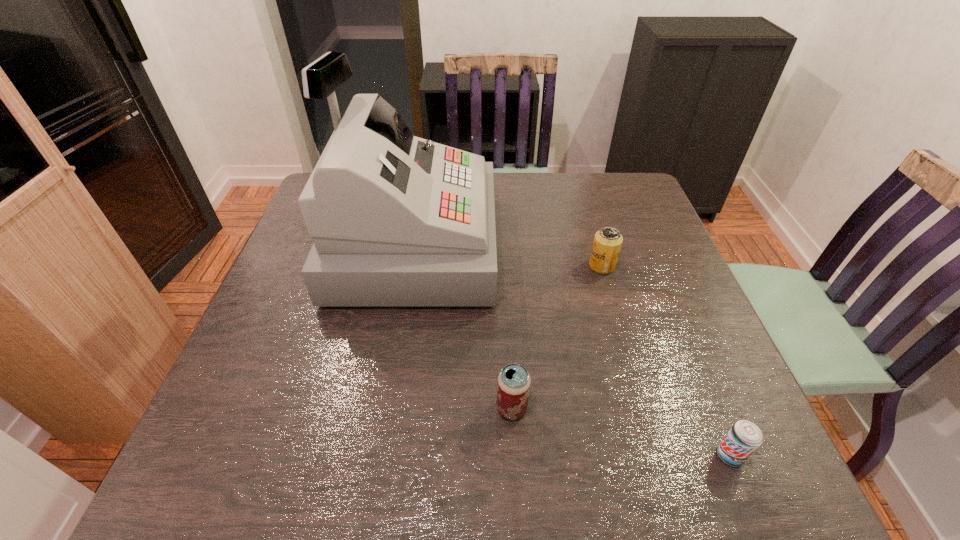
I want to click on free location that satisfies the following two spatial constraints: 1. on the back side of the leftmost beer can; 2. on the keypad side of the tallest object, so (502, 246).

Where is `free point that satisfies the following two spatial constraints: 1. on the back side of the second beer can from left to right; 2. on the right side of the third farthest object`? free point that satisfies the following two spatial constraints: 1. on the back side of the second beer can from left to right; 2. on the right side of the third farthest object is located at coordinates (504, 266).

Locate an element on the screen. vacant space that satisfies the following two spatial constraints: 1. on the keypad side of the tallest object; 2. on the right side of the second object from right to left is located at coordinates (409, 266).

Where is `vacant region that satisfies the following two spatial constraints: 1. on the front side of the shortest beer can; 2. on the right side of the leftmost beer can`? vacant region that satisfies the following two spatial constraints: 1. on the front side of the shortest beer can; 2. on the right side of the leftmost beer can is located at coordinates (515, 455).

The width and height of the screenshot is (960, 540). What are the coordinates of `free spot that satisfies the following two spatial constraints: 1. on the keypad side of the second beer can from left to right; 2. on the left side of the cash register` in the screenshot? It's located at (409, 266).